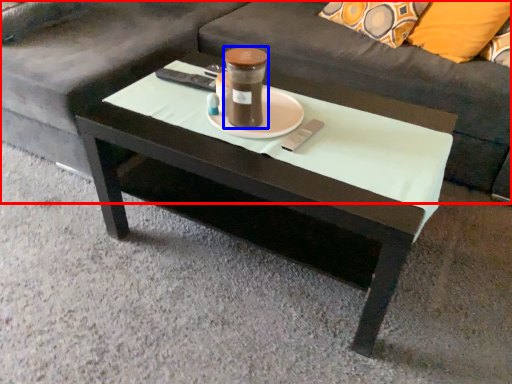
Question: Which object is further to the camera taking this photo, studio couch (highlighted by a red box) or beverage (highlighted by a blue box)?

Choices:
 (A) studio couch
 (B) beverage

Answer: (A)